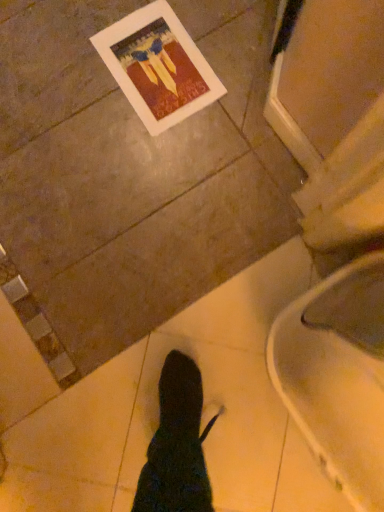
Question: Is matte paper postcard at upper left smaller than white glossy toilet at lower right?

Choices:
 (A) no
 (B) yes

Answer: (B)

Question: Is matte paper postcard at upper left positioned far away from white glossy toilet at lower right?

Choices:
 (A) no
 (B) yes

Answer: (A)

Question: Is matte paper postcard at upper left looking in the opposite direction of white glossy toilet at lower right?

Choices:
 (A) no
 (B) yes

Answer: (A)

Question: Can you confirm if matte paper postcard at upper left is bigger than white glossy toilet at lower right?

Choices:
 (A) no
 (B) yes

Answer: (A)

Question: Is matte paper postcard at upper left further to camera compared to white glossy toilet at lower right?

Choices:
 (A) yes
 (B) no

Answer: (A)

Question: Can you confirm if matte paper postcard at upper left is wider than white glossy toilet at lower right?

Choices:
 (A) no
 (B) yes

Answer: (A)

Question: Does white glossy toilet at lower right have a lesser width compared to matte paper postcard at upper left?

Choices:
 (A) no
 (B) yes

Answer: (A)

Question: From the image's perspective, is white glossy toilet at lower right above matte paper postcard at upper left?

Choices:
 (A) no
 (B) yes

Answer: (A)

Question: Is white glossy toilet at lower right turned away from matte paper postcard at upper left?

Choices:
 (A) yes
 (B) no

Answer: (B)

Question: Is white glossy toilet at lower right placed right next to matte paper postcard at upper left?

Choices:
 (A) yes
 (B) no

Answer: (B)

Question: From a real-world perspective, is white glossy toilet at lower right beneath matte paper postcard at upper left?

Choices:
 (A) yes
 (B) no

Answer: (B)

Question: Is white glossy toilet at lower right behind matte paper postcard at upper left?

Choices:
 (A) no
 (B) yes

Answer: (A)

Question: From the image's perspective, is matte paper postcard at upper left positioned above or below white glossy toilet at lower right?

Choices:
 (A) below
 (B) above

Answer: (B)